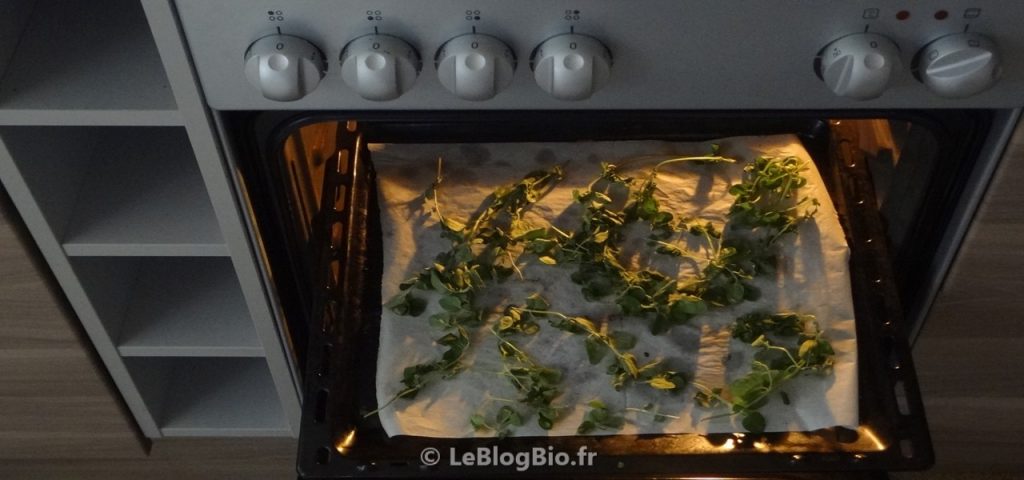
Locate an element on the screen. Image resolution: width=1024 pixels, height=480 pixels. dial knobs on oven is located at coordinates (555, 72), (476, 64), (375, 76), (288, 63), (870, 70), (947, 70).